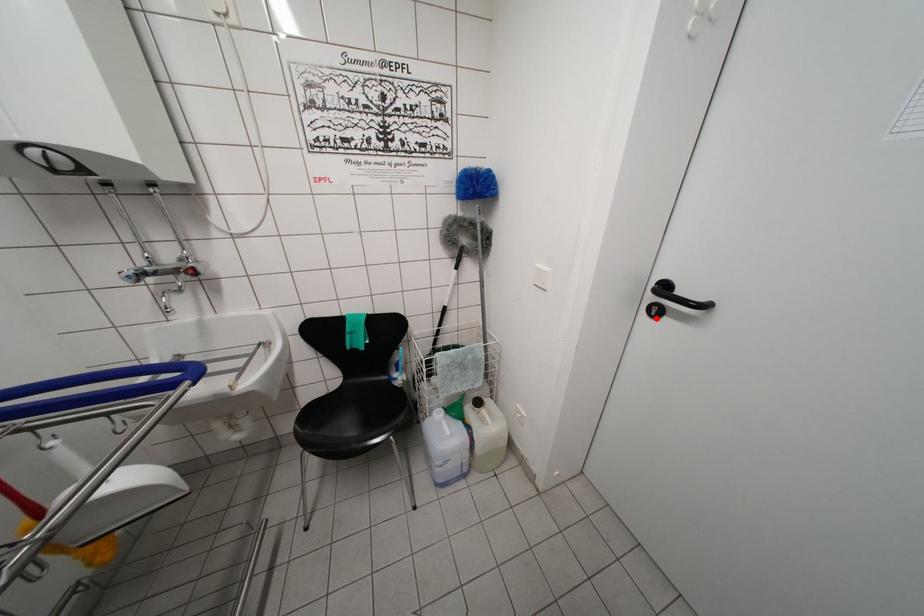
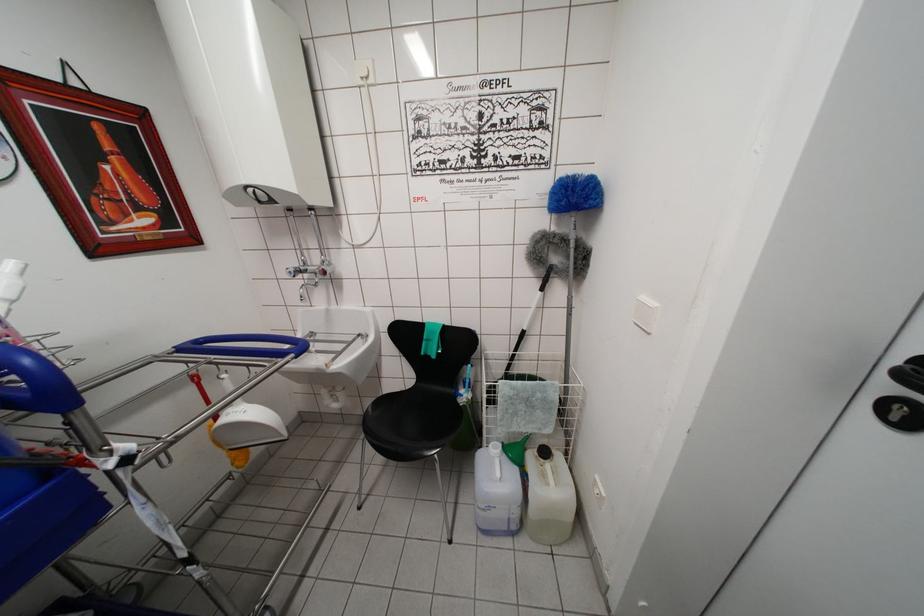
The point at the highlighted location is marked in the first image. Where is the corresponding point in the second image?

(897, 423)